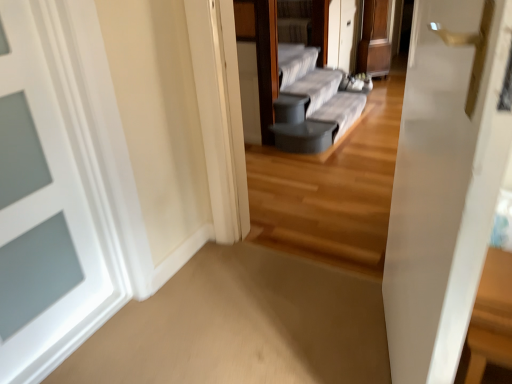
Question: Considering the relative sizes of gray fabric couch at center and wooden table at right in the image provided, is gray fabric couch at center taller than wooden table at right?

Choices:
 (A) no
 (B) yes

Answer: (A)

Question: From the image's perspective, would you say gray fabric couch at center is shown under wooden table at right?

Choices:
 (A) yes
 (B) no

Answer: (B)

Question: Would you consider gray fabric couch at center to be distant from wooden table at right?

Choices:
 (A) yes
 (B) no

Answer: (A)

Question: Does gray fabric couch at center have a greater width compared to wooden table at right?

Choices:
 (A) yes
 (B) no

Answer: (B)

Question: Does gray fabric couch at center touch wooden table at right?

Choices:
 (A) yes
 (B) no

Answer: (B)

Question: Is the position of gray fabric couch at center more distant than that of wooden table at right?

Choices:
 (A) no
 (B) yes

Answer: (B)

Question: Is white painted wood door at left to the left of gray fabric couch at center from the viewer's perspective?

Choices:
 (A) no
 (B) yes

Answer: (B)

Question: From a real-world perspective, is white painted wood door at left physically above gray fabric couch at center?

Choices:
 (A) no
 (B) yes

Answer: (B)

Question: Is white painted wood door at left surrounding gray fabric couch at center?

Choices:
 (A) yes
 (B) no

Answer: (B)

Question: Considering the relative sizes of white painted wood door at left and gray fabric couch at center in the image provided, is white painted wood door at left shorter than gray fabric couch at center?

Choices:
 (A) yes
 (B) no

Answer: (B)

Question: Are white painted wood door at left and gray fabric couch at center far apart?

Choices:
 (A) no
 (B) yes

Answer: (B)

Question: Does white painted wood door at left touch gray fabric couch at center?

Choices:
 (A) no
 (B) yes

Answer: (A)

Question: Is wooden table at right positioned beyond the bounds of gray fabric couch at center?

Choices:
 (A) no
 (B) yes

Answer: (B)